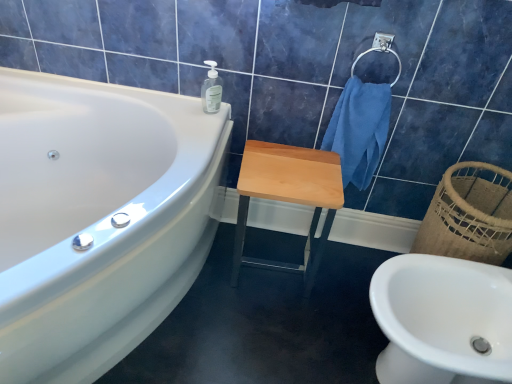
This screenshot has width=512, height=384. I want to click on vacant area that is in front of transparent plastic soap dispenser at upper center, so click(x=199, y=127).